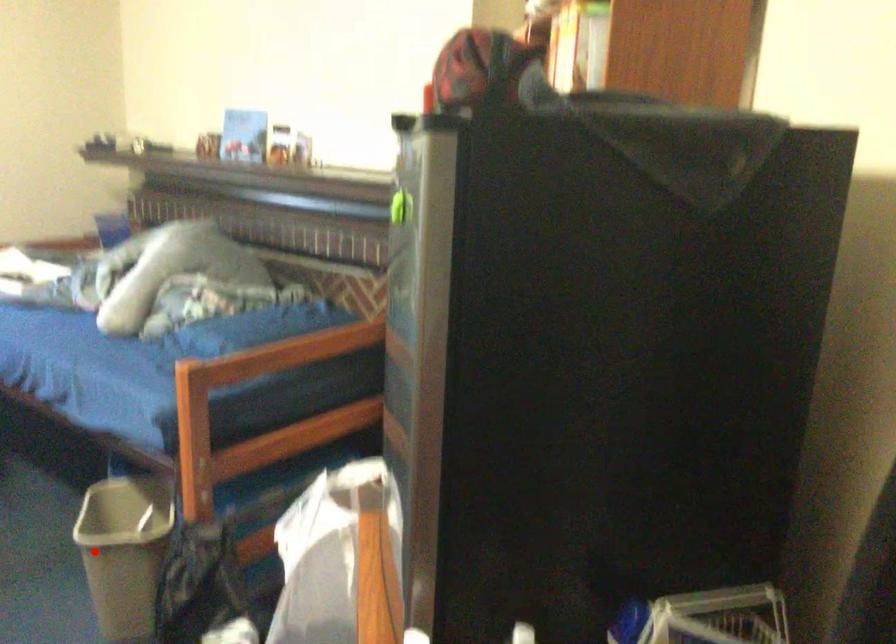
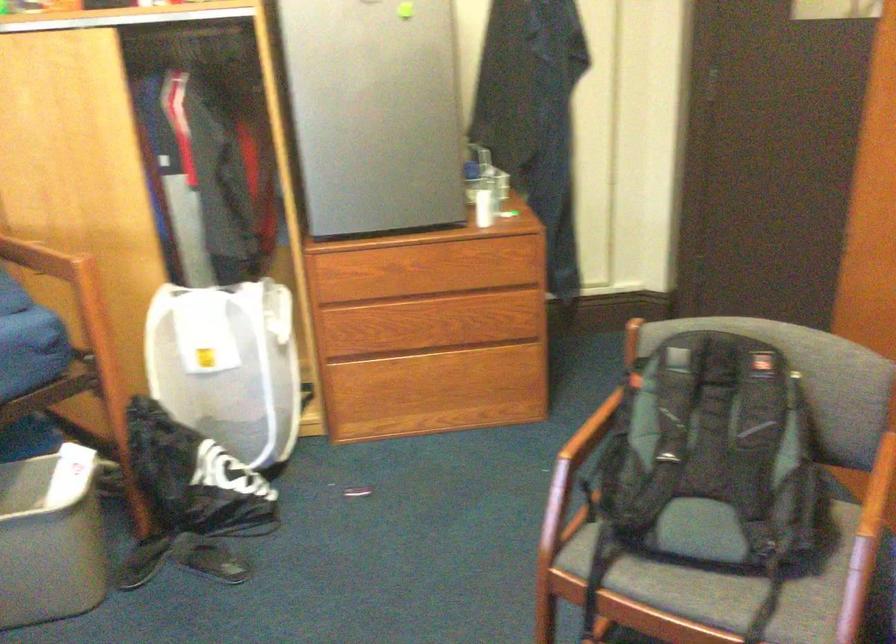
Question: I am providing you with two images of the same scene from different viewpoints. Image1 has a red point marked. In image2, the corresponding 3D location appears at what relative position? Reply with the corresponding letter.

Choices:
 (A) Closer
 (B) Farther

Answer: (A)